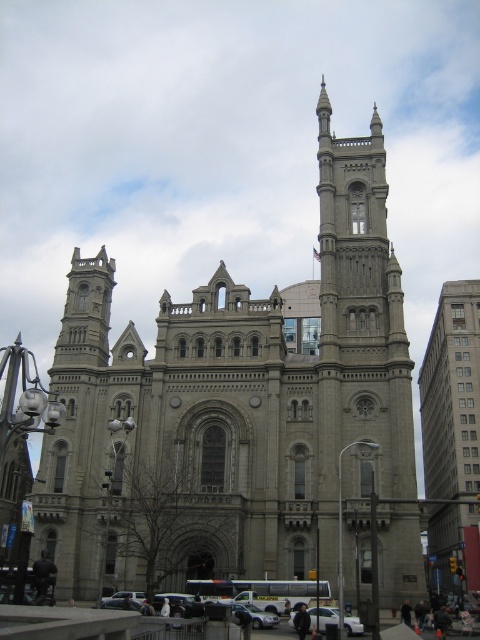
Which of these two, gray stone church at center or gray stone tower at upper center, stands shorter?

Standing shorter between the two is gray stone tower at upper center.

Is gray stone church at center thinner than gray stone tower at upper center?

Incorrect, gray stone church at center's width is not less than gray stone tower at upper center's.

Between point (343, 472) and point (388, 305), which one is positioned behind?

The point (388, 305) is more distant.

Find the location of a particular element. The image size is (480, 640). gray stone church at center is located at coordinates (238, 410).

Where is `gray stone church at center`? gray stone church at center is located at coordinates (238, 410).

Measure the distance between gray stone church at center and white matte car at lower center.

They are 90.10 feet apart.

Describe the element at coordinates (238, 410) in the screenshot. I see `gray stone church at center` at that location.

The width and height of the screenshot is (480, 640). Find the location of `gray stone church at center`. gray stone church at center is located at coordinates (238, 410).

Does point (448, 540) lie behind point (320, 611)?

Yes, it is.

Where is `gray stone building at right`? The height and width of the screenshot is (640, 480). gray stone building at right is located at coordinates (452, 435).